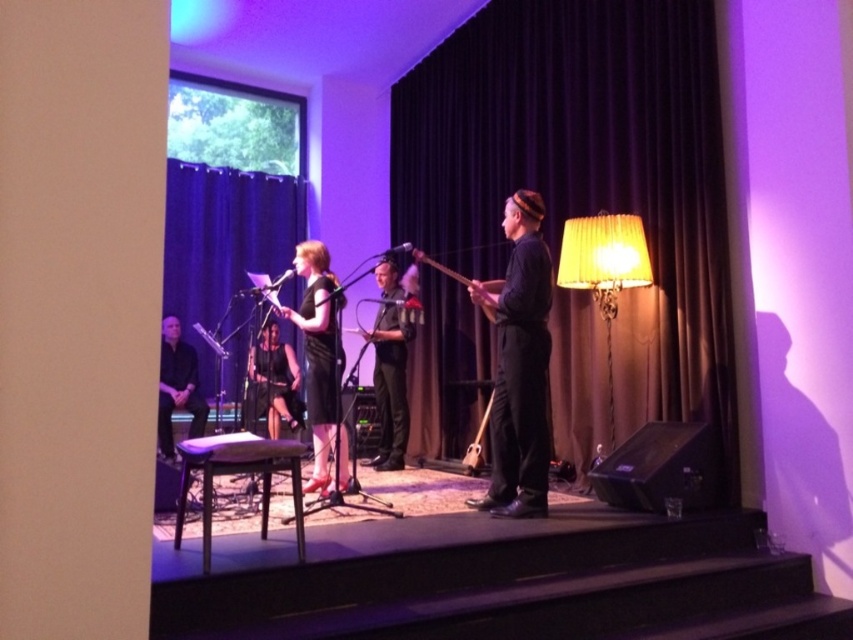
In the scene shown: Does brown velvet curtain at center lie behind gold pleated fabric lampshade at right?

No, it is in front of gold pleated fabric lampshade at right.

Does brown velvet curtain at center have a lesser height compared to gold pleated fabric lampshade at right?

No.

Between point (610, 154) and point (627, 268), which one is positioned behind?

Point (610, 154)

Locate an element on the screen. brown velvet curtain at center is located at coordinates (585, 176).

Can you confirm if purple fabric stool at center is shorter than wooden acoustic guitar at center?

No.

Does purple fabric stool at center have a larger size compared to wooden acoustic guitar at center?

Incorrect, purple fabric stool at center is not larger than wooden acoustic guitar at center.

Is point (276, 442) positioned before point (491, 298)?

Yes, it is.

Find the location of a particular element. The width and height of the screenshot is (853, 640). purple fabric stool at center is located at coordinates (238, 472).

Is gold pleated fabric lampshade at right bigger than black satin dress at center?

Incorrect, gold pleated fabric lampshade at right is not larger than black satin dress at center.

The width and height of the screenshot is (853, 640). I want to click on gold pleated fabric lampshade at right, so click(604, 272).